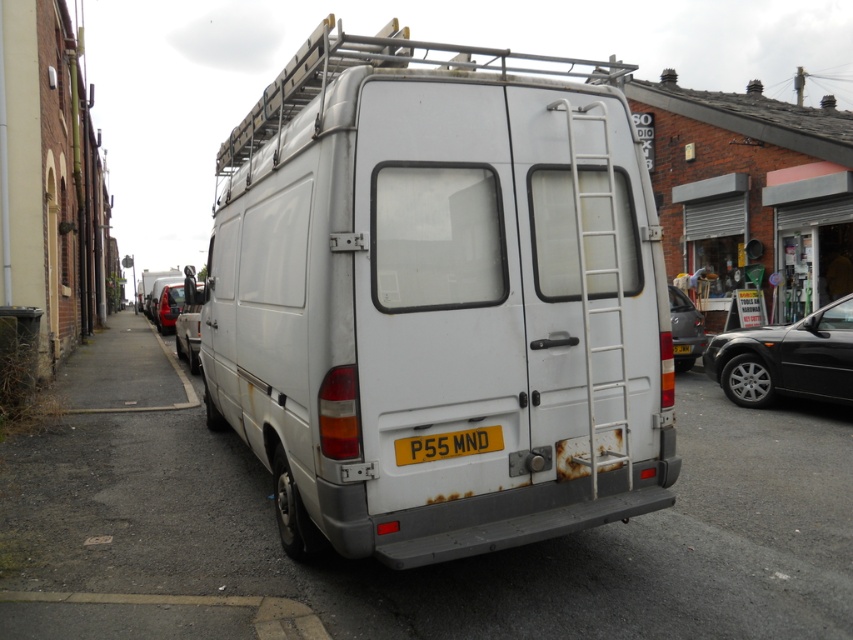
Question: Is shiny black sedan at right to the right of white metal ladder at rear from the viewer's perspective?

Choices:
 (A) no
 (B) yes

Answer: (B)

Question: Which point is closer to the camera taking this photo?

Choices:
 (A) (84, 372)
 (B) (770, 388)
 (C) (175, 314)
 (D) (674, 346)

Answer: (B)

Question: Which object appears farthest from the camera in this image?

Choices:
 (A) metallic silver van at center
 (B) white metal ladder at rear

Answer: (A)

Question: Can you confirm if asphalt at lower left is positioned above metallic silver van at center?

Choices:
 (A) yes
 (B) no

Answer: (B)

Question: Which is farther from the asphalt at lower left?

Choices:
 (A) yellow matte license plate at center
 (B) metallic silver car at right
 (C) metallic red car at left
 (D) metallic silver van at center

Answer: (B)

Question: Does metallic silver van at center appear over metallic red car at left?

Choices:
 (A) yes
 (B) no

Answer: (B)